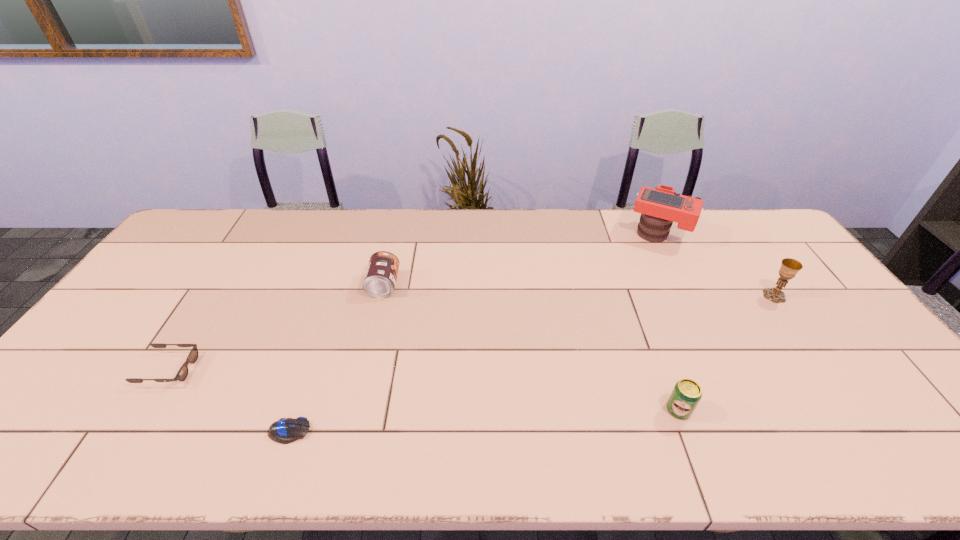
Locate an element on the screen. This screenshot has width=960, height=540. camera is located at coordinates (661, 206).

I want to click on the tallest object, so click(x=661, y=206).

This screenshot has width=960, height=540. Identify the location of the fifth shortest object. (790, 267).

Image resolution: width=960 pixels, height=540 pixels. I want to click on chalice, so click(790, 267).

Locate an element on the screen. The height and width of the screenshot is (540, 960). the third object from left to right is located at coordinates (381, 274).

Find the location of a particular element. The width and height of the screenshot is (960, 540). beer can is located at coordinates (686, 394).

You are a GUI agent. You are given a task and a screenshot of the screen. Output one action in this format:
    pyautogui.click(x=<x>, y=<y>)
    Task: Click on the leftmost object
    
    Given the screenshot: What is the action you would take?
    pyautogui.click(x=182, y=374)

This screenshot has height=540, width=960. Find the location of `the third nearest object`. the third nearest object is located at coordinates (182, 374).

Find the location of a particular element. The width and height of the screenshot is (960, 540). the shortest object is located at coordinates (286, 430).

At what (x,y) coordinates should I click in order to perform the action: click on the second object from left to right. Please return your answer as a coordinate pair (x, y). The height and width of the screenshot is (540, 960). Looking at the image, I should click on (286, 430).